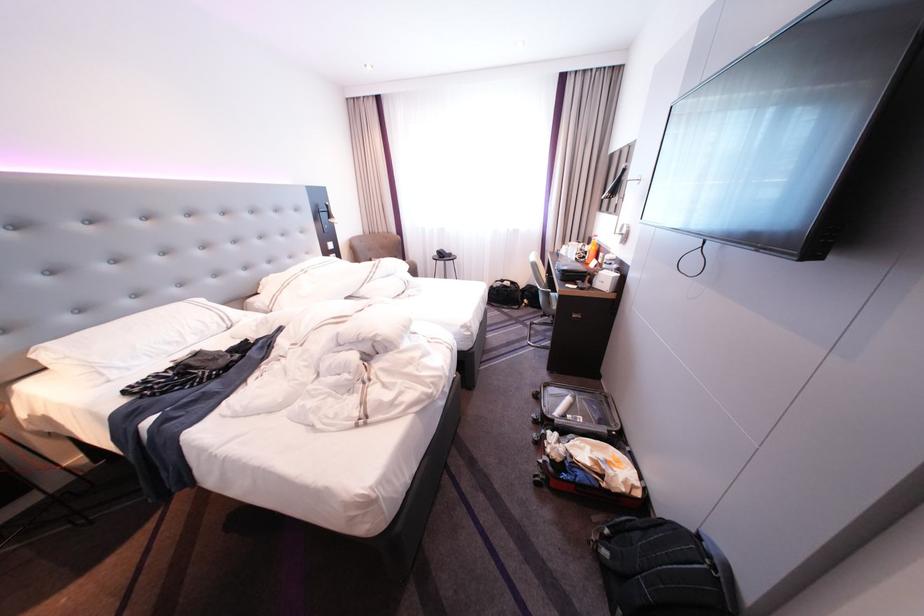
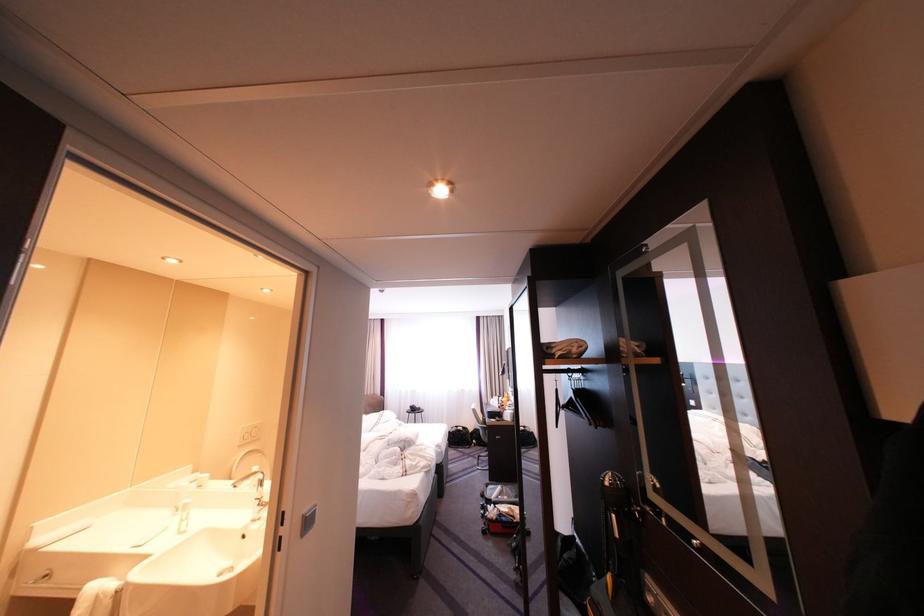
Locate, in the second image, the point that corresponds to (565,421) in the first image.

(503, 501)